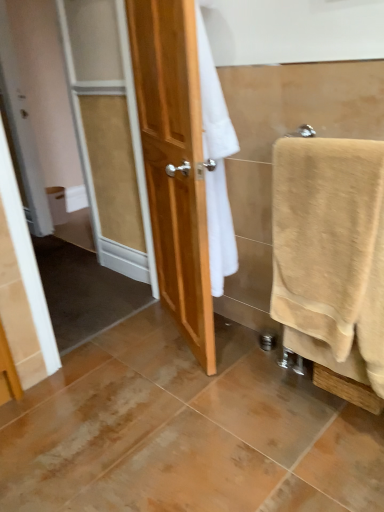
Question: Can you confirm if beige cotton towel at right is smaller than white matte toilet paper at left?

Choices:
 (A) yes
 (B) no

Answer: (B)

Question: From a real-world perspective, is beige cotton towel at right on top of white matte toilet paper at left?

Choices:
 (A) no
 (B) yes

Answer: (B)

Question: Does beige cotton towel at right have a greater height compared to white matte toilet paper at left?

Choices:
 (A) yes
 (B) no

Answer: (A)

Question: Is beige cotton towel at right thinner than white matte toilet paper at left?

Choices:
 (A) yes
 (B) no

Answer: (B)

Question: From a real-world perspective, is beige cotton towel at right below white matte toilet paper at left?

Choices:
 (A) no
 (B) yes

Answer: (A)

Question: Considering the relative positions of beige cotton towel at right and white matte toilet paper at left in the image provided, is beige cotton towel at right to the left of white matte toilet paper at left from the viewer's perspective?

Choices:
 (A) yes
 (B) no

Answer: (B)

Question: Can you confirm if white matte toilet paper at left is smaller than beige cotton towel at right?

Choices:
 (A) yes
 (B) no

Answer: (A)

Question: Can you confirm if white matte toilet paper at left is bigger than beige cotton towel at right?

Choices:
 (A) yes
 (B) no

Answer: (B)

Question: Does white matte toilet paper at left appear on the right side of beige cotton towel at right?

Choices:
 (A) yes
 (B) no

Answer: (B)

Question: Is the position of white matte toilet paper at left less distant than that of beige cotton towel at right?

Choices:
 (A) yes
 (B) no

Answer: (B)

Question: Does white matte toilet paper at left have a greater width compared to beige cotton towel at right?

Choices:
 (A) no
 (B) yes

Answer: (A)

Question: Is white matte toilet paper at left to the left of beige cotton towel at right from the viewer's perspective?

Choices:
 (A) yes
 (B) no

Answer: (A)

Question: Based on their sizes in the image, would you say white matte toilet paper at left is bigger or smaller than beige cotton towel at right?

Choices:
 (A) small
 (B) big

Answer: (A)